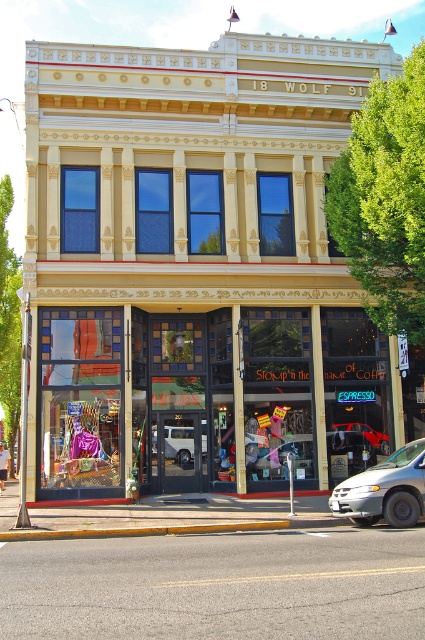
You are a delivery person trying to enter the store through the entrance. The entrance has a translucent glass window at center and a white matte van at center. Which object is taller so you can look through it to see inside the store?

The translucent glass window at center has a greater height compared to the white matte van at center, so you can look through the translucent glass window at center to see inside the store.

You are standing in front of the two story building and want to enter the store. There is a translucent glass window at center and a white matte van at center. Which object is closer to you?

The translucent glass window at center is closer to the viewer than the white matte van at center.